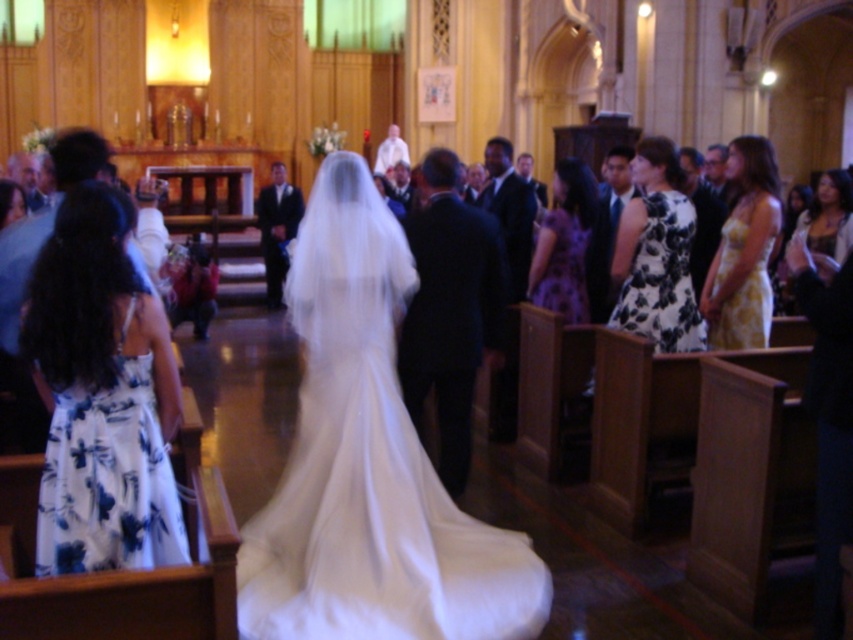
Question: Is white sheer veil at center to the left of black floral dress at center from the viewer's perspective?

Choices:
 (A) yes
 (B) no

Answer: (A)

Question: Which point is closer to the camera?

Choices:
 (A) white sheer veil at center
 (B) black floral dress at center
 (C) purple satin dress at center

Answer: (A)

Question: Can you confirm if white floral dress at left is smaller than matte gold necklace at upper right?

Choices:
 (A) no
 (B) yes

Answer: (B)

Question: Among these points, which one is farthest from the camera?

Choices:
 (A) (579, 173)
 (B) (693, 349)

Answer: (A)

Question: Can you confirm if white sheer veil at center is positioned to the right of white floral dress at left?

Choices:
 (A) yes
 (B) no

Answer: (A)

Question: Estimate the real-world distances between objects in this image. Which object is farther from the white sheer veil at center?

Choices:
 (A) white floral dress at left
 (B) yellow floral dress at right
 (C) black floral dress at center
 (D) matte gold necklace at upper right

Answer: (D)